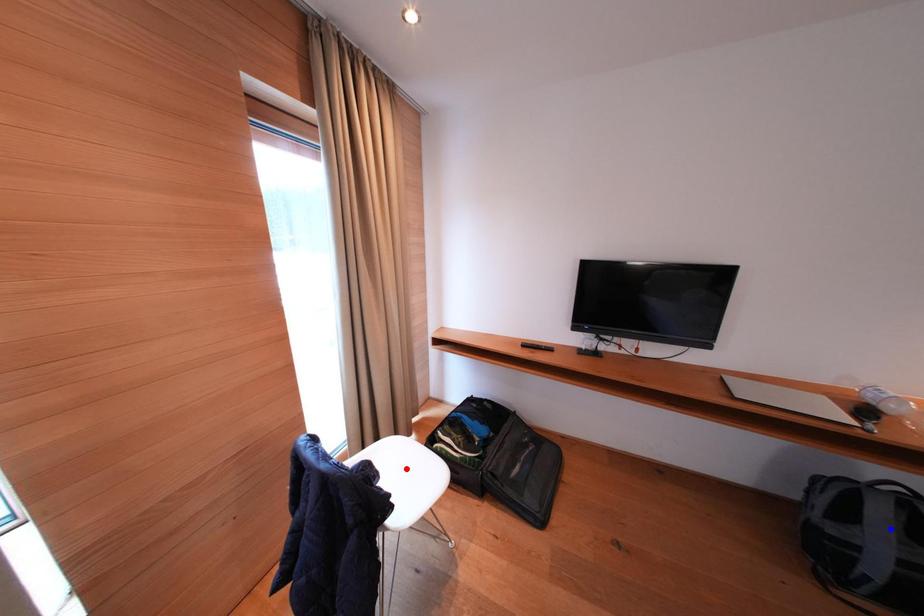
Question: In the image, two points are highlighted. Which point is nearer to the camera? Reply with the corresponding letter.

Choices:
 (A) blue point
 (B) red point

Answer: (A)